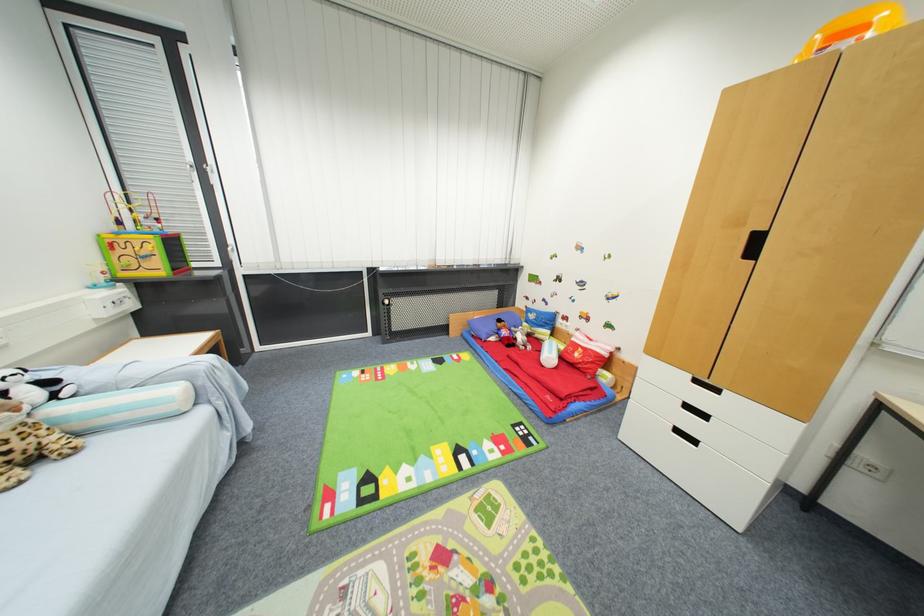
Find the location of a particular element. black cabinet handle is located at coordinates (754, 245).